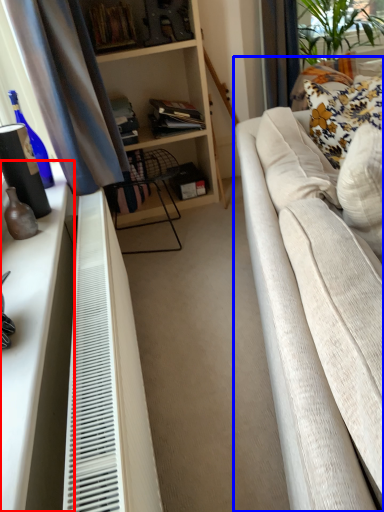
Question: Which object appears farthest to the camera in this image, dresser (highlighted by a red box) or studio couch (highlighted by a blue box)?

Choices:
 (A) dresser
 (B) studio couch

Answer: (A)